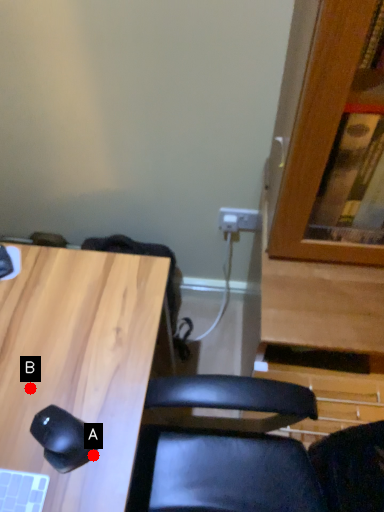
Question: Two points are circled on the image, labeled by A and B beside each circle. Which point is closer to the camera?

Choices:
 (A) A is closer
 (B) B is closer

Answer: (A)